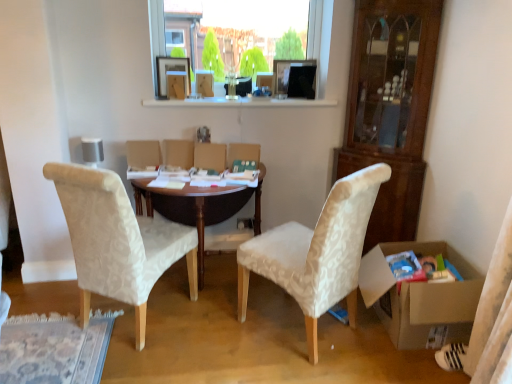
Question: Is the depth of brown wooden table at center greater than that of transparent glass window at upper center?

Choices:
 (A) no
 (B) yes

Answer: (A)

Question: From a real-world perspective, is brown wooden table at center located beneath transparent glass window at upper center?

Choices:
 (A) no
 (B) yes

Answer: (B)

Question: Can you confirm if brown wooden table at center is smaller than transparent glass window at upper center?

Choices:
 (A) yes
 (B) no

Answer: (B)

Question: From a real-world perspective, does brown wooden table at center stand above transparent glass window at upper center?

Choices:
 (A) no
 (B) yes

Answer: (A)

Question: Is brown wooden table at center outside transparent glass window at upper center?

Choices:
 (A) yes
 (B) no

Answer: (A)

Question: Is beige fabric chair at left, which is the first chair from left to right, bigger or smaller than brown wooden table at center?

Choices:
 (A) big
 (B) small

Answer: (B)

Question: Is beige fabric chair at left, which is the first chair from left to right, in front of or behind brown wooden table at center in the image?

Choices:
 (A) behind
 (B) front

Answer: (B)

Question: In terms of width, does beige fabric chair at left, which is the first chair from left to right, look wider or thinner when compared to brown wooden table at center?

Choices:
 (A) wide
 (B) thin

Answer: (B)

Question: From a real-world perspective, is beige fabric chair at left, which is the 2th chair from right to left, positioned above or below brown wooden table at center?

Choices:
 (A) above
 (B) below

Answer: (A)

Question: From a real-world perspective, relative to patterned fabric chair at center, which is the 2th chair in left-to-right order, is wooden picture frame at upper center vertically above or below?

Choices:
 (A) below
 (B) above

Answer: (B)

Question: From the image's perspective, relative to patterned fabric chair at center, which is the 2th chair in left-to-right order, is wooden picture frame at upper center above or below?

Choices:
 (A) below
 (B) above

Answer: (B)

Question: From their relative heights in the image, would you say wooden picture frame at upper center is taller or shorter than patterned fabric chair at center, which is the 2th chair in left-to-right order?

Choices:
 (A) tall
 (B) short

Answer: (B)

Question: Would you say wooden picture frame at upper center is to the left or to the right of patterned fabric chair at center, the first chair viewed from the right, in the picture?

Choices:
 (A) right
 (B) left

Answer: (B)

Question: From a real-world perspective, is transparent glass window at upper center positioned above or below brown wooden table at center?

Choices:
 (A) below
 (B) above

Answer: (B)

Question: In terms of size, does transparent glass window at upper center appear bigger or smaller than brown wooden table at center?

Choices:
 (A) big
 (B) small

Answer: (B)